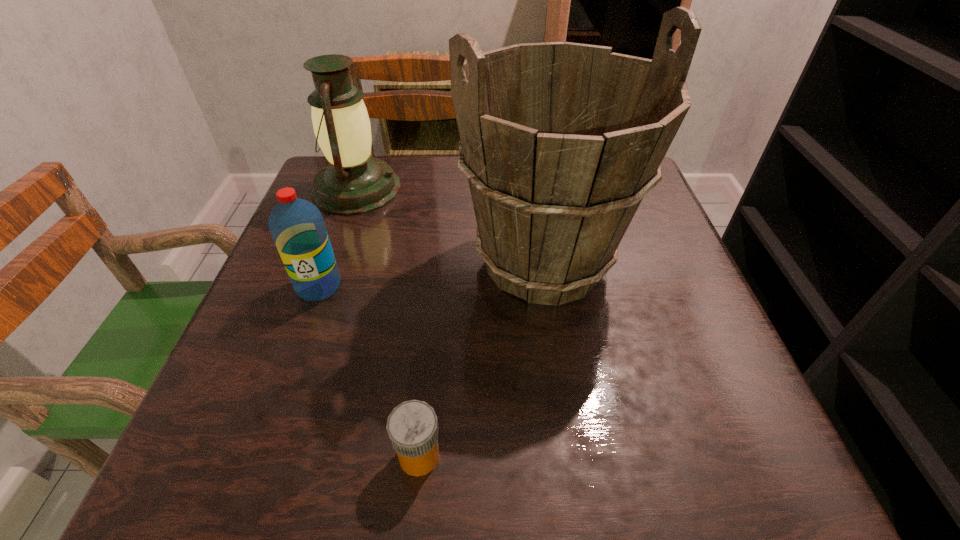
The height and width of the screenshot is (540, 960). What are the coordinates of `bucket` in the screenshot? It's located at (560, 142).

Find the location of `the rightmost object`. the rightmost object is located at coordinates (560, 142).

This screenshot has width=960, height=540. Find the location of `the third shortest object`. the third shortest object is located at coordinates (353, 182).

At what (x,y) coordinates should I click in order to perform the action: click on the second shortest object. Please return your answer as a coordinate pair (x, y). Image resolution: width=960 pixels, height=540 pixels. Looking at the image, I should click on (297, 226).

At what (x,y) coordinates should I click in order to perform the action: click on the nearest object. Please return your answer as a coordinate pair (x, y). The height and width of the screenshot is (540, 960). Looking at the image, I should click on (412, 426).

Locate an element on the screen. This screenshot has height=540, width=960. the third object from left to right is located at coordinates (412, 426).

Identify the location of vacant region located 0.050m on the right of the rightmost object. (653, 262).

This screenshot has height=540, width=960. In order to click on vacant space located with the light compartment facing forward on the lantern in this screenshot , I will do click(500, 189).

You are a GUI agent. You are given a task and a screenshot of the screen. Output one action in this format:
    pyautogui.click(x=<x>, y=<y>)
    Task: Click on the vacant area located 0.050m on the front label of the water bottle
    This screenshot has width=960, height=540.
    Given the screenshot: What is the action you would take?
    pyautogui.click(x=305, y=323)

I want to click on vacant space situated on the label side of the medicine, so click(x=491, y=456).